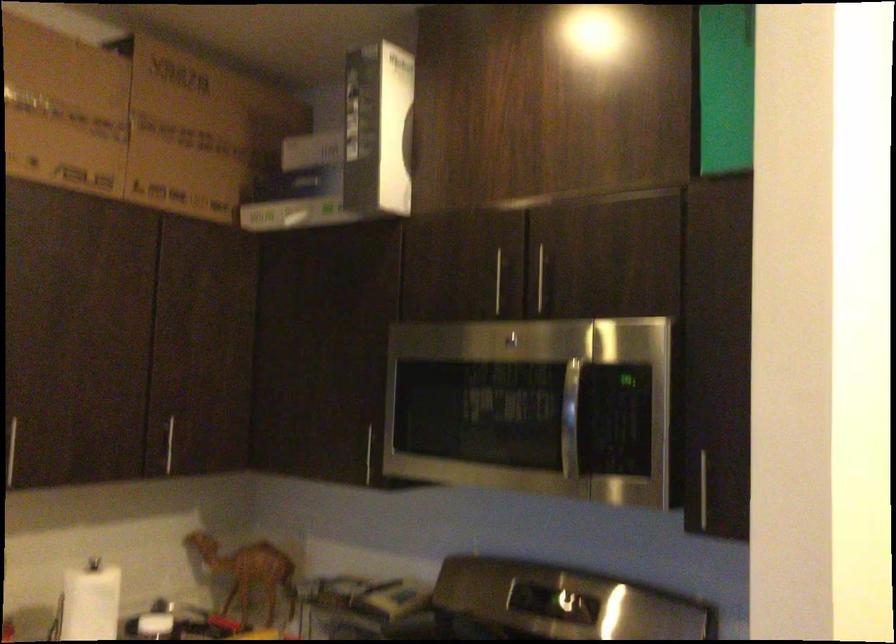
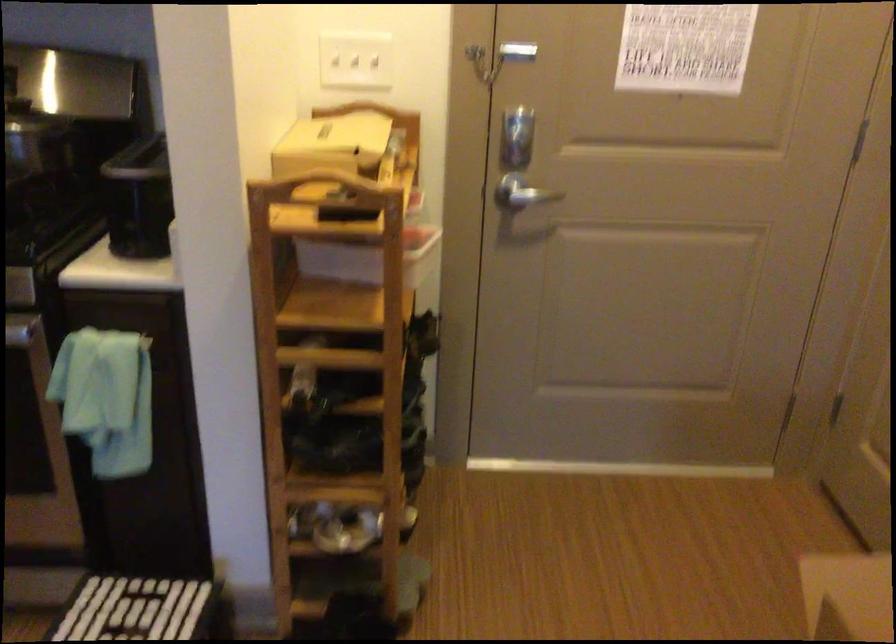
The first image is from the beginning of the video and the second image is from the end. How did the camera likely rotate when shooting the video?

The camera rotated toward right-down.